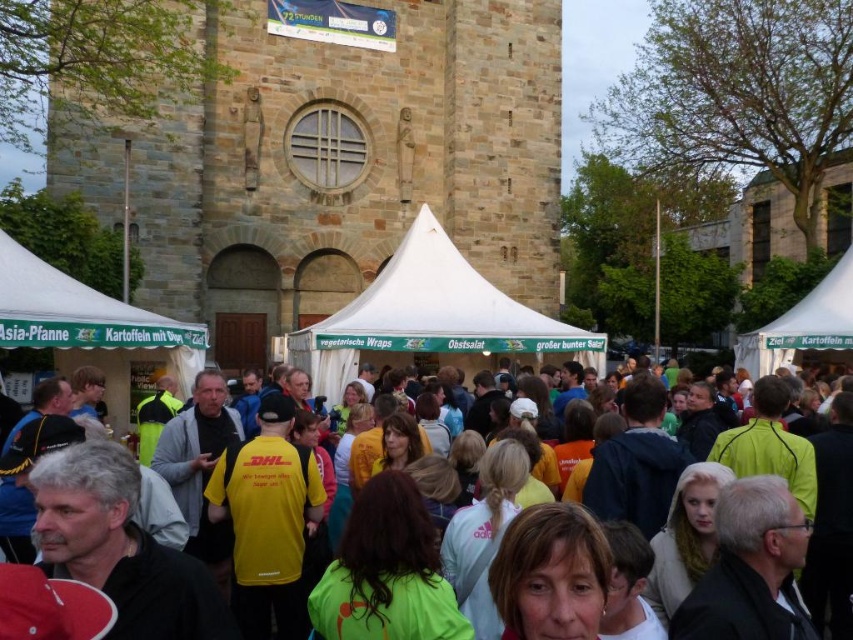
Question: Can you confirm if brown stone church at center is positioned above yellow athletic shirt at center?

Choices:
 (A) yes
 (B) no

Answer: (A)

Question: Is yellow athletic shirt at center smaller than white canvas tent at center?

Choices:
 (A) no
 (B) yes

Answer: (A)

Question: Which object is the closest to the yellow athletic shirt at center?

Choices:
 (A) white canvas tent at center
 (B) brown stone church at center

Answer: (A)

Question: Which point is farther to the camera?

Choices:
 (A) yellow athletic shirt at center
 (B) brown stone church at center

Answer: (B)

Question: Can you confirm if brown stone church at center is positioned below yellow athletic shirt at center?

Choices:
 (A) yes
 (B) no

Answer: (B)

Question: Based on their relative distances, which object is nearer to the brown stone church at center?

Choices:
 (A) white canvas tent at center
 (B) yellow athletic shirt at center

Answer: (A)